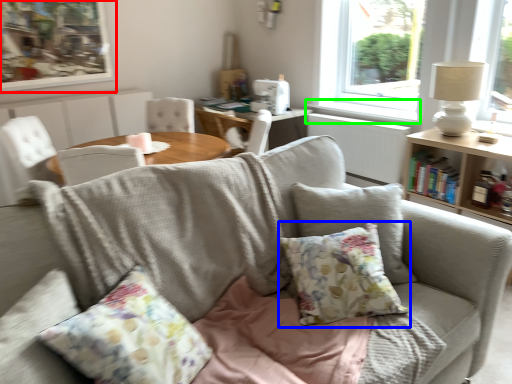
Question: Which is farther away from picture frame (highlighted by a red box)? pillow (highlighted by a blue box) or window sill (highlighted by a green box)?

Choices:
 (A) pillow
 (B) window sill

Answer: (A)